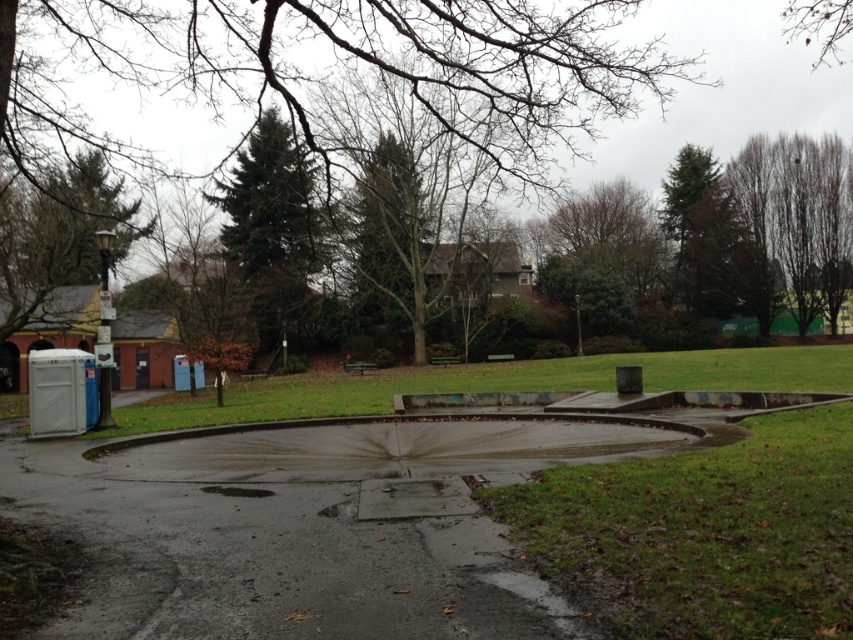
You are standing in the park and want to find the taller tree between the green textured tree at upper center and the green textured tree at upper left. Which one should you look up to see?

The green textured tree at upper center is much taller than the green textured tree at upper left, so you should look up to see the green textured tree at upper center.

You are a park visitor trying to decide which tree to sit under for shade. The green textured tree at upper center and the brown leafy tree at upper right are both options. Which tree would provide more shade coverage based on their widths?

The brown leafy tree at upper right has a greater width than the green textured tree at upper center, so it would provide more shade coverage.

You are standing in the park and want to walk towards the green textured tree at upper center and the green textured tree at upper left. Which tree will you reach first?

The green textured tree at upper center is closer to you than the green textured tree at upper left, so you will reach the green textured tree at upper center first.